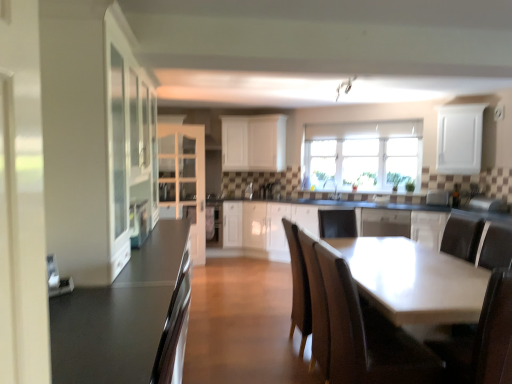
Describe the element at coordinates (437, 197) in the screenshot. I see `white glossy dishwasher at center, arranged as the 1th appliance when viewed from the right` at that location.

This screenshot has width=512, height=384. I want to click on white glossy sink at center, so click(x=334, y=189).

Consider the image. Measure the distance between white matte cabinet at upper center, the 2th cabinetry when ordered from back to front, and camera.

6.48 meters.

In order to click on white glossy dishwasher at center in this screenshot , I will do `click(385, 222)`.

From the image's perspective, is white glossy cabinet at center, positioned as the 3th cabinetry in front-to-back order, above or below smooth dark gray countertop at left?

white glossy cabinet at center, positioned as the 3th cabinetry in front-to-back order, is situated higher than smooth dark gray countertop at left in the image.

Could you tell me if white glossy cabinet at center, positioned as the 3th cabinetry in front-to-back order, is turned towards smooth dark gray countertop at left?

Yes, white glossy cabinet at center, positioned as the 3th cabinetry in front-to-back order, is facing smooth dark gray countertop at left.

How many degrees apart are the facing directions of white glossy cabinet at center, the second cabinetry from the right, and smooth dark gray countertop at left?

white glossy cabinet at center, the second cabinetry from the right, and smooth dark gray countertop at left are facing 57 degrees away from each other.

Is white glossy cabinet at center, acting as the fourth cabinetry starting from the back, outside of smooth dark gray countertop at left?

That's correct, white glossy cabinet at center, acting as the fourth cabinetry starting from the back, is outside of smooth dark gray countertop at left.

Which object is thinner, white matte cabinet at upper right, which is the 2th cabinetry from front to back, or dark brown leather swivel chair at lower right?

With smaller width is white matte cabinet at upper right, which is the 2th cabinetry from front to back.

This screenshot has width=512, height=384. What are the coordinates of `cabinetry that is the 4th object located above the dark brown leather swivel chair at lower right (from the image's perspective)` in the screenshot? It's located at (459, 139).

Is white matte cabinet at upper right, which appears as the 5th cabinetry when viewed from the back, to the left or to the right of dark brown leather swivel chair at lower right in the image?

white matte cabinet at upper right, which appears as the 5th cabinetry when viewed from the back, is to the right of dark brown leather swivel chair at lower right.

Considering the relative sizes of white matte cabinet at upper right, positioned as the 6th cabinetry in left-to-right order, and white glossy sink at center in the image provided, is white matte cabinet at upper right, positioned as the 6th cabinetry in left-to-right order, shorter than white glossy sink at center?

No.

From a real-world perspective, which object stands above the other?

white matte cabinet at upper right, positioned as the 6th cabinetry in left-to-right order, is physically above.

Could white glossy sink at center be considered to be inside white matte cabinet at upper right, which is the 2th cabinetry from front to back?

No, white matte cabinet at upper right, which is the 2th cabinetry from front to back, does not contain white glossy sink at center.

Does white matte cabinet at upper right, which is the 2th cabinetry from front to back, turn towards white glossy sink at center?

No, white matte cabinet at upper right, which is the 2th cabinetry from front to back, is not facing towards white glossy sink at center.

Considering the sizes of objects white glossy sink at center and white matte cabinet at upper center, which is the fourth cabinetry from left to right, in the image provided, who is wider, white glossy sink at center or white matte cabinet at upper center, which is the fourth cabinetry from left to right,?

With larger width is white matte cabinet at upper center, which is the fourth cabinetry from left to right.

Identify the location of sink behind the white matte cabinet at upper center, marked as the third cabinetry in a right-to-left arrangement. This screenshot has width=512, height=384. (334, 189).

Is white glossy sink at center far away from white matte cabinet at upper center, positioned as the 5th cabinetry in front-to-back order?

Absolutely, white glossy sink at center is distant from white matte cabinet at upper center, positioned as the 5th cabinetry in front-to-back order.

Considering the relative sizes of white glossy sink at center and white matte cabinet at upper center, marked as the third cabinetry in a right-to-left arrangement, in the image provided, is white glossy sink at center bigger than white matte cabinet at upper center, marked as the third cabinetry in a right-to-left arrangement,?

No.

From the picture: How many degrees apart are the facing directions of white matte cabinet at upper right, which is the 2th cabinetry from front to back, and smooth dark gray countertop at left?

57 degrees.

From the image's perspective, is white matte cabinet at upper right, which appears as the 5th cabinetry when viewed from the back, located above or below smooth dark gray countertop at left?

From the image's perspective, white matte cabinet at upper right, which appears as the 5th cabinetry when viewed from the back, appears above smooth dark gray countertop at left.

Between white matte cabinet at upper right, which is the 2th cabinetry from front to back, and smooth dark gray countertop at left, which one is positioned in front?

smooth dark gray countertop at left.

The width and height of the screenshot is (512, 384). I want to click on countertop beneath the white matte cabinet at upper right, which appears as the 5th cabinetry when viewed from the back (from a real-world perspective), so click(x=128, y=318).

From a real-world perspective, which object stands above the other?

white matte cabinet at upper center, positioned as the first cabinetry in back-to-front order, is physically above.

Is white matte cabinet at upper center, the third cabinetry when ordered from left to right, situated inside smooth dark gray countertop at left or outside?

white matte cabinet at upper center, the third cabinetry when ordered from left to right, is outside smooth dark gray countertop at left.

Which object is positioned more to the left, white matte cabinet at upper center, the third cabinetry when ordered from left to right, or smooth dark gray countertop at left?

From the viewer's perspective, smooth dark gray countertop at left appears more on the left side.

Starting from the smooth dark gray countertop at left, which cabinetry is the 1st one to the right? Please provide its 2D coordinates.

[(234, 143)]

Does white glossy cabinet at center, acting as the fourth cabinetry starting from the back, come behind clear glass windows at upper center?

No, white glossy cabinet at center, acting as the fourth cabinetry starting from the back, is in front of clear glass windows at upper center.

From the image's perspective, which one is positioned higher, white glossy cabinet at center, placed as the 5th cabinetry when sorted from left to right, or clear glass windows at upper center?

clear glass windows at upper center appears higher in the image.

Is clear glass windows at upper center located within white glossy cabinet at center, the second cabinetry from the right?

No, clear glass windows at upper center is not surrounded by white glossy cabinet at center, the second cabinetry from the right.

Is point (417, 231) more distant than point (395, 148)?

No, (417, 231) is in front of (395, 148).

Locate an element on the screen. countertop above the white glossy cabinet at center, positioned as the 3th cabinetry in front-to-back order (from a real-world perspective) is located at coordinates (128, 318).

From the dark brown leather swivel chair at lower right, count 2nd cabinetry to the right and point to it. Please provide its 2D coordinates.

[(459, 139)]

From the image, which object appears to be farther from dark brown leather swivel chair at lower right, smooth dark gray countertop at left or satin silver toaster at center, the third appliance in the front-to-back sequence?

Based on the image, satin silver toaster at center, the third appliance in the front-to-back sequence, appears to be further to dark brown leather swivel chair at lower right.

From the image, which object appears to be nearer to white matte cabinet at upper center, which is the fourth cabinetry from left to right, satin silver toaster at center, marked as the first appliance in a back-to-front arrangement, or white glossy dishwasher at center?

Among the two, satin silver toaster at center, marked as the first appliance in a back-to-front arrangement, is located nearer to white matte cabinet at upper center, which is the fourth cabinetry from left to right.

Estimate the real-world distances between objects in this image. Which object is closer to white glossy cabinet at left, the 1th cabinetry from the front, smooth dark gray countertop at left or wooden chair at lower right?

Based on the image, smooth dark gray countertop at left appears to be nearer to white glossy cabinet at left, the 1th cabinetry from the front.

Which object lies further to the anchor point white glossy cabinet at left, which is counted as the 6th cabinetry, starting from the back, white glossy dishwasher at center, placed as the third appliance when sorted from left to right, or white glossy sink at center?

Based on the image, white glossy dishwasher at center, placed as the third appliance when sorted from left to right, appears to be further to white glossy cabinet at left, which is counted as the 6th cabinetry, starting from the back.

From the picture: When comparing their distances from white glossy cabinet at left, which ranks as the 2th cabinetry in left-to-right order, does wooden chair at lower right or white glossy sink at center seem closer?

wooden chair at lower right is closer to white glossy cabinet at left, which ranks as the 2th cabinetry in left-to-right order.

From the image, which object appears to be nearer to dark brown leather swivel chair at lower right, white matte cabinet at upper right, which appears as the 5th cabinetry when viewed from the back, or wooden chair at lower right?

wooden chair at lower right is closer to dark brown leather swivel chair at lower right.

Based on their spatial positions, is white glossy cabinet at left, which ranks as the 2th cabinetry in left-to-right order, or white glossy cabinet at center, acting as the fourth cabinetry starting from the back, further from wooden chair at lower right?

white glossy cabinet at center, acting as the fourth cabinetry starting from the back, is positioned further to the anchor wooden chair at lower right.

Estimate the real-world distances between objects in this image. Which object is further from clear glass windows at upper center, wooden chair at lower right or white glossy dishwasher at center, which is the second appliance in bottom-to-top order?

Among the two, wooden chair at lower right is located further to clear glass windows at upper center.

Identify the location of dish washer between satin silver toaster at center, which is counted as the 3th appliance, starting from the bottom, and white glossy dishwasher at center, placed as the third appliance when sorted from left to right. (385, 222).

Locate an element on the screen. This screenshot has height=384, width=512. appliance situated between white matte cabinet at upper center, positioned as the first cabinetry in back-to-front order, and white glossy dishwasher at center from left to right is located at coordinates (249, 191).

Identify the location of countertop between white glossy toaster at left, the third appliance viewed from the right, and dark brown leather swivel chair at lower right from left to right. This screenshot has width=512, height=384. (128, 318).

Image resolution: width=512 pixels, height=384 pixels. Find the location of `window between white matte cabinet at upper center, which ranks as the fourth cabinetry in right-to-left order, and white glossy dishwasher at center, which is the 2th appliance from top to bottom`. window between white matte cabinet at upper center, which ranks as the fourth cabinetry in right-to-left order, and white glossy dishwasher at center, which is the 2th appliance from top to bottom is located at coordinates click(x=364, y=154).